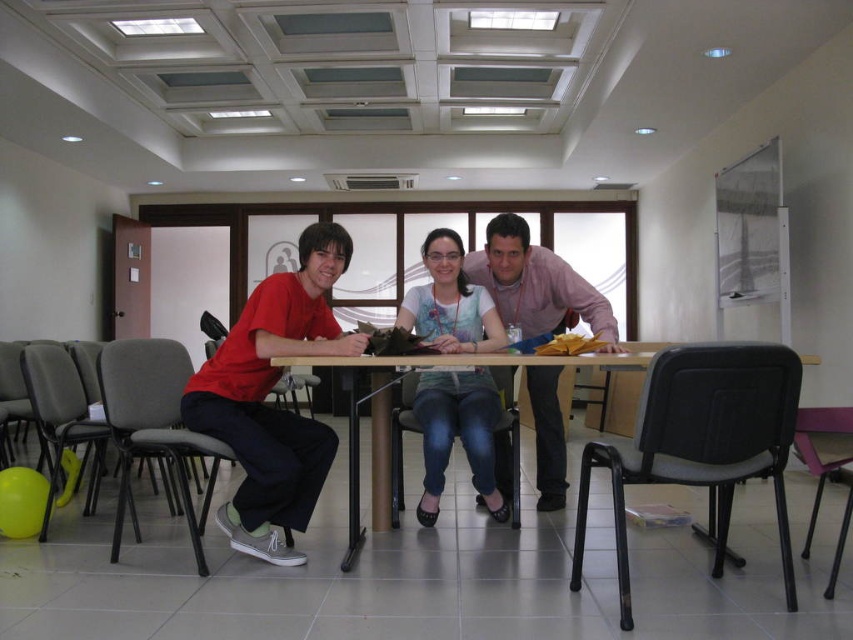
Looking at this image, is the position of matte white shirt at center less distant than that of wooden table at center?

That is False.

Is matte white shirt at center bigger than wooden table at center?

No.

Who is more forward, (438, 234) or (386, 456)?

Point (438, 234) is more forward.

This screenshot has width=853, height=640. I want to click on matte white shirt at center, so click(x=457, y=435).

Is matte red shirt at left below wooden table at center?

No, matte red shirt at left is not below wooden table at center.

Which is below, matte red shirt at left or wooden table at center?

wooden table at center is lower down.

Is point (308, 428) positioned in front of point (624, 365)?

That is False.

Where is `matte red shirt at left`? Image resolution: width=853 pixels, height=640 pixels. matte red shirt at left is located at coordinates (268, 392).

Can you confirm if matte red shirt at left is positioned below matte white shirt at center?

Incorrect, matte red shirt at left is not positioned below matte white shirt at center.

Does point (341, 234) come closer to viewer compared to point (492, 401)?

Yes, point (341, 234) is closer to viewer.

This screenshot has height=640, width=853. Identify the location of matte red shirt at left. (268, 392).